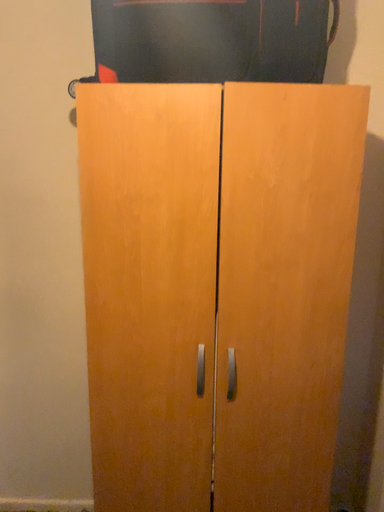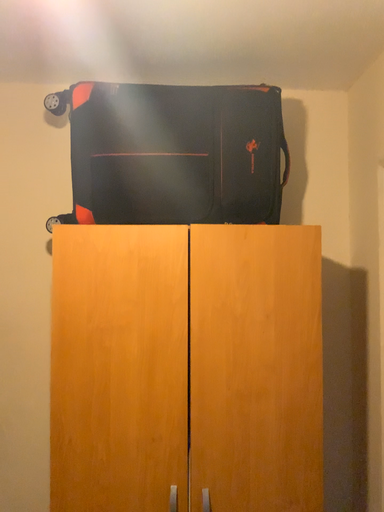
Question: Which way did the camera rotate in the video?

Choices:
 (A) rotated upward
 (B) rotated downward

Answer: (A)